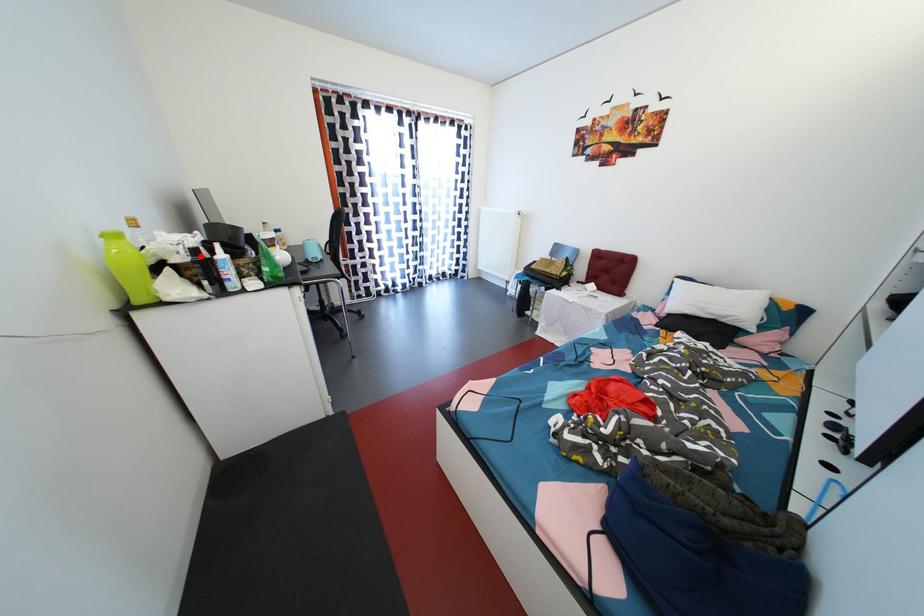
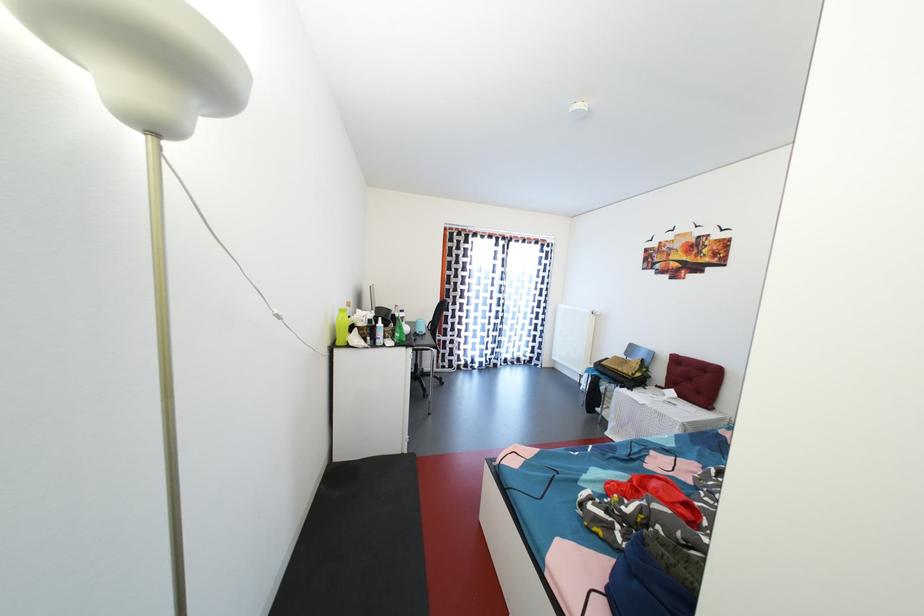
Where in the second image is the point corresponding to the highlighted location from the first image?

(377, 326)